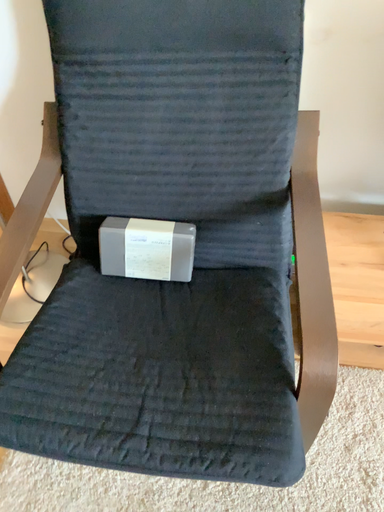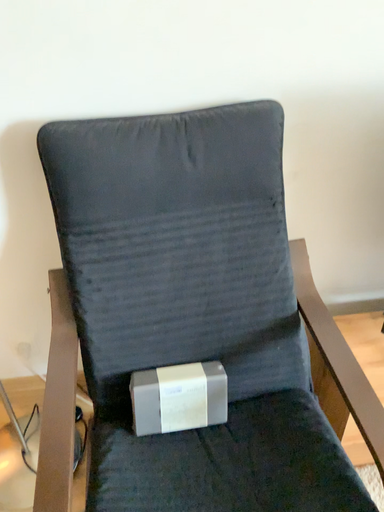
Question: How did the camera likely rotate when shooting the video?

Choices:
 (A) rotated downward
 (B) rotated upward

Answer: (B)